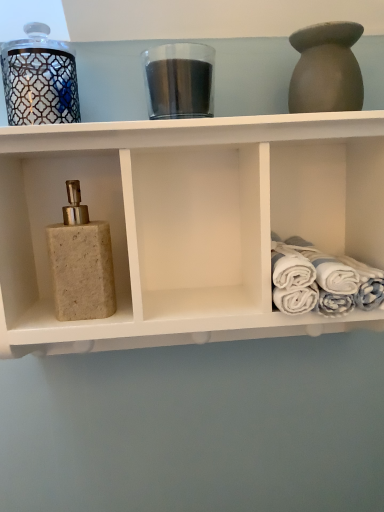
This screenshot has width=384, height=512. Find the location of `metallic glass candle at upper left, the first glass jar when ordered from left to right`. metallic glass candle at upper left, the first glass jar when ordered from left to right is located at coordinates (39, 79).

I want to click on matte clay vase at upper right, so click(x=326, y=69).

This screenshot has height=512, width=384. What do you see at coordinates (187, 222) in the screenshot?
I see `beige stone soap dispenser at left` at bounding box center [187, 222].

I want to click on beige stone soap dispenser at left, so click(81, 262).

From a real-world perspective, is beige stone soap dispenser at left above or below transparent glass jar at center, the second glass jar when ordered from left to right?

Clearly, from a real-world perspective, beige stone soap dispenser at left is below transparent glass jar at center, the second glass jar when ordered from left to right.

From the image's perspective, is beige stone soap dispenser at left under transparent glass jar at center, which is the 1th glass jar from right to left?

Yes, from the image's perspective, beige stone soap dispenser at left is beneath transparent glass jar at center, which is the 1th glass jar from right to left.

Which object is more forward, beige stone soap dispenser at left or transparent glass jar at center, the second glass jar when ordered from left to right?

transparent glass jar at center, the second glass jar when ordered from left to right, is closer to the camera.

From the picture: Based on their positions, is white cotton towels at right located to the left or right of beige stone soap dispenser at left?

white cotton towels at right is to the right of beige stone soap dispenser at left.

Can you confirm if white cotton towels at right is thinner than beige stone soap dispenser at left?

No, white cotton towels at right is not thinner than beige stone soap dispenser at left.

Locate an element on the screen. This screenshot has height=512, width=384. toiletry located above the white cotton towels at right (from a real-world perspective) is located at coordinates (x=81, y=262).

From the image's perspective, relative to beige stone soap dispenser at left, is white cotton towels at right above or below?

white cotton towels at right is below beige stone soap dispenser at left.

From a real-world perspective, is beige stone soap dispenser at left positioned under white cotton towels at right based on gravity?

No.

Which object is positioned more to the left, beige stone soap dispenser at left or white cotton towels at right?

beige stone soap dispenser at left is more to the left.

From a real-world perspective, which is physically below, beige stone soap dispenser at left or matte clay vase at upper right?

In real-world perspective, beige stone soap dispenser at left is lower.

From the picture: Is beige stone soap dispenser at left turned away from matte clay vase at upper right?

No, beige stone soap dispenser at left is not facing the opposite direction of matte clay vase at upper right.

Considering the sizes of beige stone soap dispenser at left and matte clay vase at upper right in the image, is beige stone soap dispenser at left bigger or smaller than matte clay vase at upper right?

Clearly, beige stone soap dispenser at left is larger in size than matte clay vase at upper right.

Is beige stone soap dispenser at left in front of or behind matte clay vase at upper right in the image?

Visually, beige stone soap dispenser at left is located in front of matte clay vase at upper right.

Is transparent glass jar at center, which is the 1th glass jar from right to left, behind metallic glass candle at upper left, the first glass jar when ordered from left to right?

Yes, it is.

Is point (162, 99) behind point (48, 105)?

No, it is not.

From the image's perspective, which is above, transparent glass jar at center, which is the 1th glass jar from right to left, or metallic glass candle at upper left, the first glass jar when ordered from left to right?

transparent glass jar at center, which is the 1th glass jar from right to left, is shown above in the image.

Does transparent glass jar at center, which is the 1th glass jar from right to left, have a greater height compared to metallic glass candle at upper left, the second glass jar from the right?

No.

Does metallic glass candle at upper left, the second glass jar from the right, have a lesser height compared to beige stone soap dispenser at left?

Indeed, metallic glass candle at upper left, the second glass jar from the right, has a lesser height compared to beige stone soap dispenser at left.

Looking at this image, how much distance is there between metallic glass candle at upper left, the second glass jar from the right, and beige stone soap dispenser at left?

The distance of metallic glass candle at upper left, the second glass jar from the right, from beige stone soap dispenser at left is 6.45 inches.

Are metallic glass candle at upper left, the first glass jar when ordered from left to right, and beige stone soap dispenser at left making contact?

No, metallic glass candle at upper left, the first glass jar when ordered from left to right, is not touching beige stone soap dispenser at left.

Which is in front, point (16, 55) or point (108, 251)?

The point (16, 55) is in front.

Is matte clay vase at upper right positioned with its back to beige stone soap dispenser at left?

No, matte clay vase at upper right is not facing the opposite direction of beige stone soap dispenser at left.

Can you confirm if matte clay vase at upper right is smaller than beige stone soap dispenser at left?

Correct, matte clay vase at upper right occupies less space than beige stone soap dispenser at left.

Looking at this image, does matte clay vase at upper right have a lesser height compared to beige stone soap dispenser at left?

Yes.

From a real-world perspective, is matte clay vase at upper right physically located above or below beige stone soap dispenser at left?

In terms of real-world spatial position, matte clay vase at upper right is above beige stone soap dispenser at left.

Find the location of a particular element. This screenshot has height=512, width=384. toiletry behind the transparent glass jar at center, which is the 1th glass jar from right to left is located at coordinates (81, 262).

Find the location of a particular element. bath towel in front of the beige stone soap dispenser at left is located at coordinates (322, 280).

When comparing their distances from beige stone soap dispenser at left, does white cotton towels at right or transparent glass jar at center, the second glass jar when ordered from left to right, seem closer?

transparent glass jar at center, the second glass jar when ordered from left to right, is positioned closer to the anchor beige stone soap dispenser at left.

Considering their positions, is beige stone soap dispenser at left positioned closer to matte clay vase at upper right than beige stone soap dispenser at left?

The object closer to matte clay vase at upper right is beige stone soap dispenser at left.

Considering their positions, is white cotton towels at right positioned further to beige stone soap dispenser at left than metallic glass candle at upper left, the second glass jar from the right?

The object further to beige stone soap dispenser at left is white cotton towels at right.

From the image, which object appears to be farther from transparent glass jar at center, the second glass jar when ordered from left to right, matte clay vase at upper right or white cotton towels at right?

white cotton towels at right is further to transparent glass jar at center, the second glass jar when ordered from left to right.

From the image, which object appears to be farther from beige stone soap dispenser at left, metallic glass candle at upper left, the second glass jar from the right, or beige stone soap dispenser at left?

metallic glass candle at upper left, the second glass jar from the right, is positioned further to the anchor beige stone soap dispenser at left.

Estimate the real-world distances between objects in this image. Which object is closer to matte clay vase at upper right, white cotton towels at right or beige stone soap dispenser at left?

Among the two, white cotton towels at right is located nearer to matte clay vase at upper right.

Considering their positions, is beige stone soap dispenser at left positioned further to transparent glass jar at center, the second glass jar when ordered from left to right, than beige stone soap dispenser at left?

beige stone soap dispenser at left is positioned further to the anchor transparent glass jar at center, the second glass jar when ordered from left to right.

Based on their spatial positions, is beige stone soap dispenser at left or transparent glass jar at center, the second glass jar when ordered from left to right, closer to beige stone soap dispenser at left?

beige stone soap dispenser at left.

Find the location of a particular element. shelf between transparent glass jar at center, the second glass jar when ordered from left to right, and white cotton towels at right in the up-down direction is located at coordinates (187, 222).

Locate an element on the screen. This screenshot has height=512, width=384. shelf between matte clay vase at upper right and white cotton towels at right vertically is located at coordinates (187, 222).

Identify the location of glass jar between beige stone soap dispenser at left and white cotton towels at right. click(x=179, y=80).

The height and width of the screenshot is (512, 384). I want to click on toiletry between metallic glass candle at upper left, the first glass jar when ordered from left to right, and beige stone soap dispenser at left, in the vertical direction, so click(x=81, y=262).